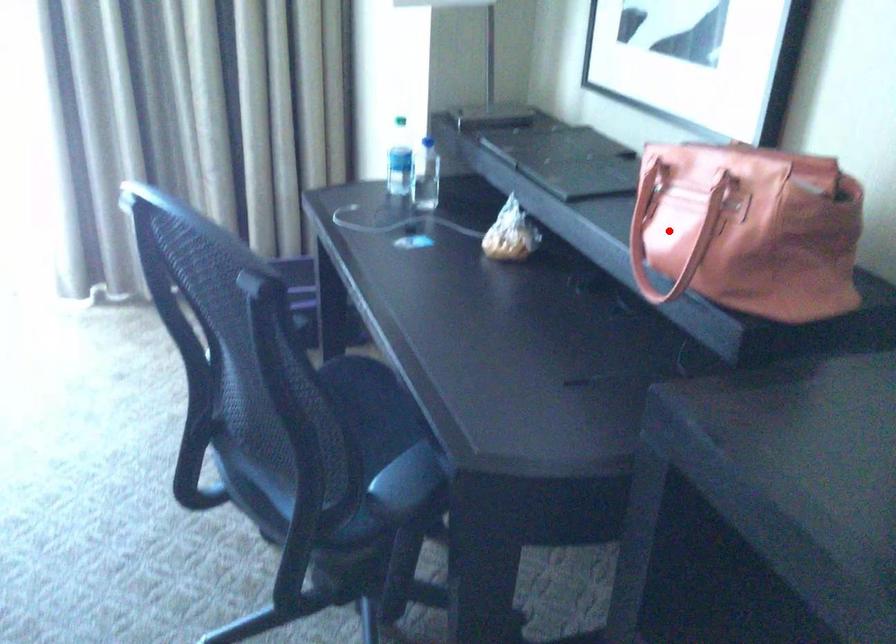
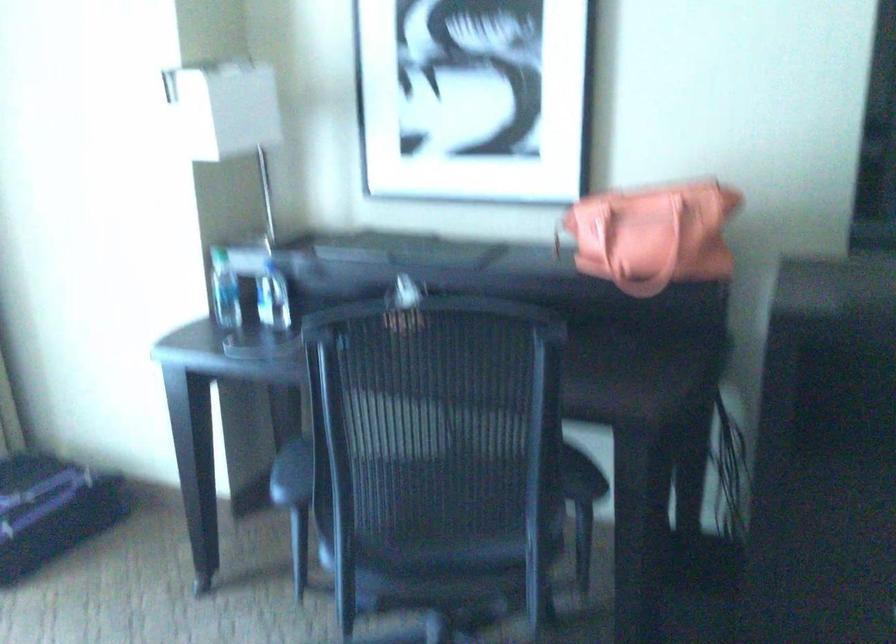
Question: I am providing you with two images of the same scene from different viewpoints. Image1 has a red point marked. In image2, the corresponding 3D location appears at what relative position? Reply with the corresponding letter.

Choices:
 (A) Closer
 (B) Farther

Answer: (B)